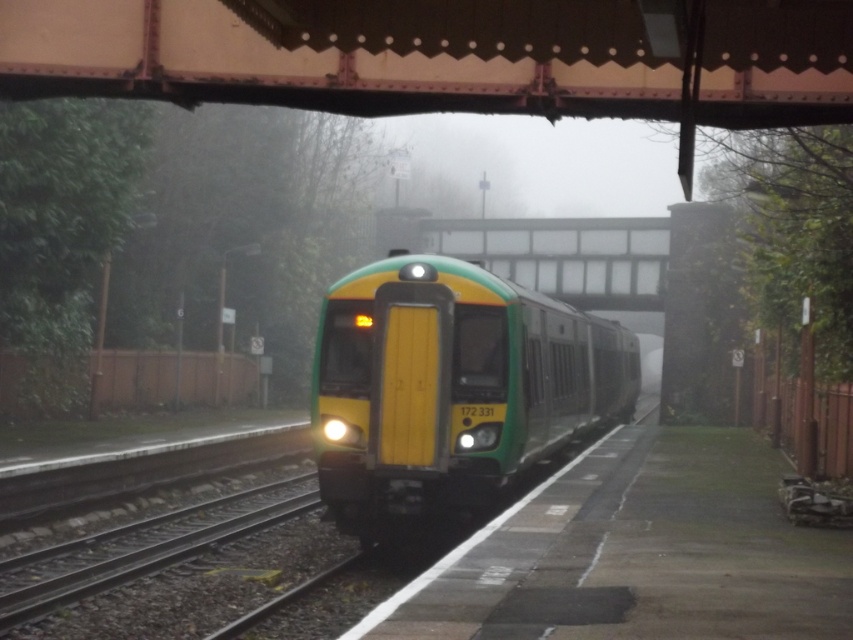
Question: Among these objects, which one is nearest to the camera?

Choices:
 (A) metallic brown bridge at upper center
 (B) green matte train at center

Answer: (A)

Question: Can you confirm if metallic brown bridge at upper center is bigger than green matte train at center?

Choices:
 (A) no
 (B) yes

Answer: (A)

Question: Does metallic brown bridge at upper center appear on the right side of green matte train at center?

Choices:
 (A) yes
 (B) no

Answer: (A)

Question: Observing the image, what is the correct spatial positioning of metallic brown bridge at upper center in reference to green matte train at center?

Choices:
 (A) right
 (B) left

Answer: (A)

Question: Which object appears closest to the camera in this image?

Choices:
 (A) green matte train at center
 (B) metallic brown bridge at upper center

Answer: (B)